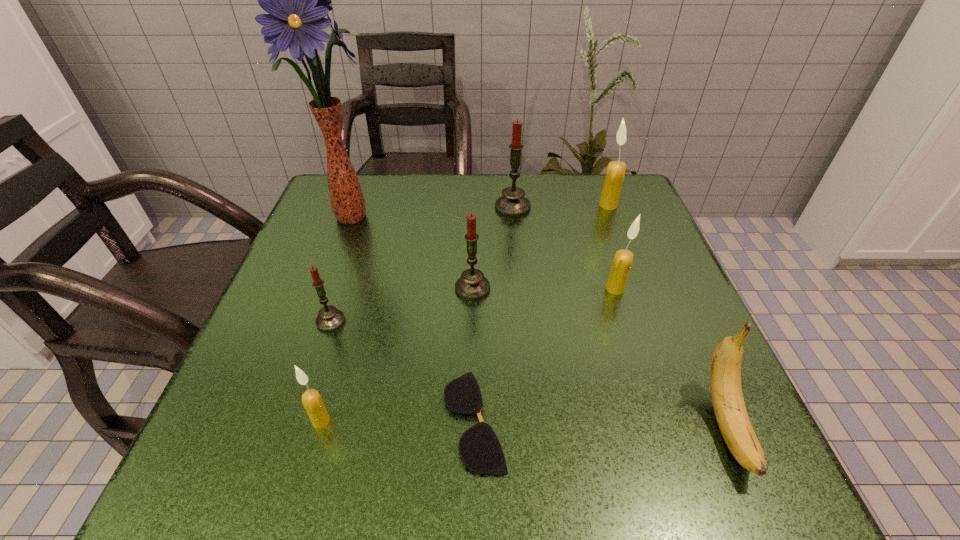
I want to click on object that is the fifth nearest to the rightmost object, so click(x=513, y=204).

Choose which candle is the nearest neighbor to the second smallest cream candle. Please provide its 2D coordinates. Your answer should be formatted as a tuple, i.e. [(x, y)], where the tuple contains the x and y coordinates of a point satisfying the conditions above.

[(472, 285)]

Identify which candle is the nearest to the yellow banana. Please provide its 2D coordinates. Your answer should be formatted as a tuple, i.e. [(x, y)], where the tuple contains the x and y coordinates of a point satisfying the conditions above.

[(623, 259)]

What are the coordinates of `the closest red candle to the smallest cream candle` in the screenshot? It's located at (329, 319).

I want to click on red candle that is the third closest to the farthest cream candle, so click(329, 319).

Identify the location of cream candle that is the closest to the second object from right to left. [623, 259].

At what (x,y) coordinates should I click in order to perform the action: click on cream candle that is the closest to the second cream candle from right to left. Please return your answer as a coordinate pair (x, y). Looking at the image, I should click on (615, 173).

Find the location of a particular element. This screenshot has width=960, height=540. free region that satisfies the following two spatial constraints: 1. on the back side of the eighth object from left to right; 2. on the right side of the shortest object is located at coordinates (476, 205).

Locate an element on the screen. The height and width of the screenshot is (540, 960). vacant space that satisfies the following two spatial constraints: 1. on the front side of the second red candle from left to right; 2. on the left side of the spectacles is located at coordinates (470, 420).

What are the coordinates of `free space that satisfies the following two spatial constraints: 1. on the front side of the second red candle from right to left; 2. on the right side of the spectacles` in the screenshot? It's located at (470, 420).